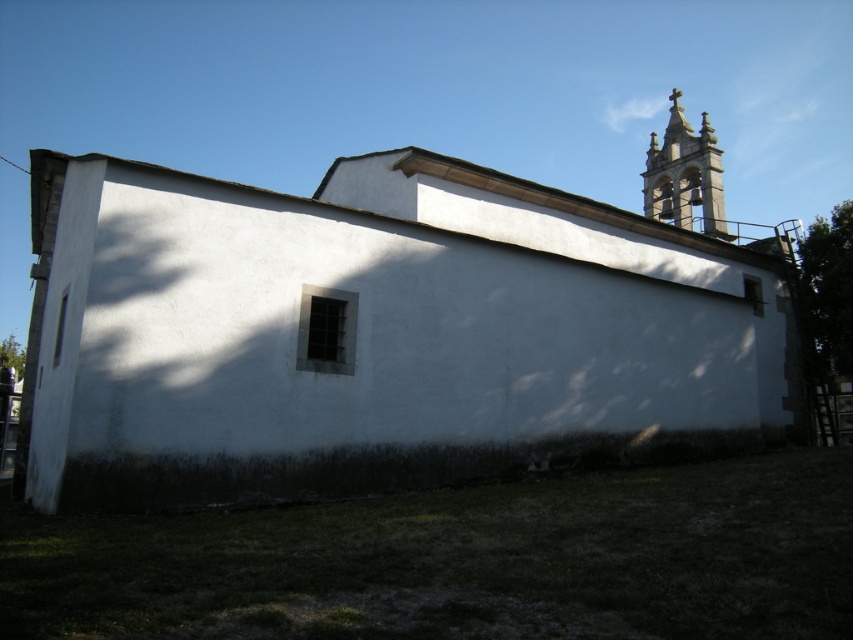
Question: Among these objects, which one is farthest from the camera?

Choices:
 (A) white matte church at center
 (B) smooth stone bell tower at upper right

Answer: (B)

Question: Which object is closer to the camera taking this photo?

Choices:
 (A) smooth stone bell tower at upper right
 (B) white matte church at center

Answer: (B)

Question: Can you confirm if white matte church at center is smaller than smooth stone bell tower at upper right?

Choices:
 (A) yes
 (B) no

Answer: (B)

Question: Does white matte church at center have a lesser width compared to smooth stone bell tower at upper right?

Choices:
 (A) no
 (B) yes

Answer: (A)

Question: Which point appears closest to the camera in this image?

Choices:
 (A) (233, 296)
 (B) (650, 186)

Answer: (A)

Question: Does white matte church at center appear over smooth stone bell tower at upper right?

Choices:
 (A) no
 (B) yes

Answer: (A)